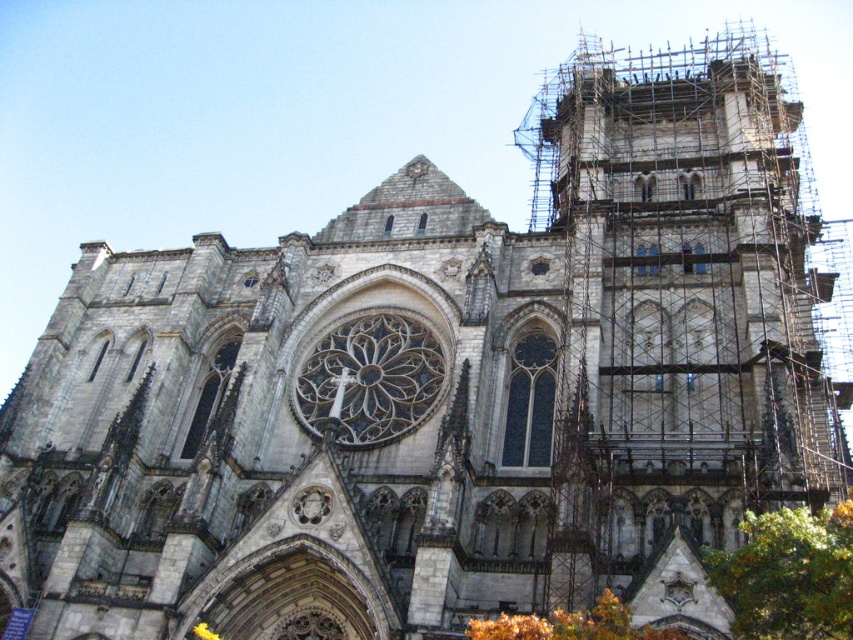
Question: Which point is farther to the camera?

Choices:
 (A) green leafy tree at lower right
 (B) orange leafy tree at lower right

Answer: (B)

Question: Can you confirm if green leafy tree at lower right is thinner than orange leafy tree at lower right?

Choices:
 (A) yes
 (B) no

Answer: (A)

Question: Is green leafy tree at lower right thinner than orange leafy tree at lower right?

Choices:
 (A) no
 (B) yes

Answer: (B)

Question: Is green leafy tree at lower right positioned in front of orange leafy tree at lower right?

Choices:
 (A) no
 (B) yes

Answer: (B)